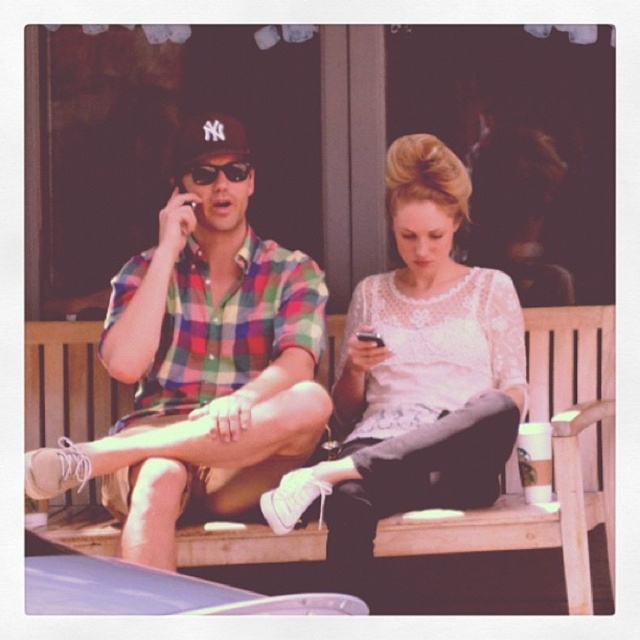
Question: Based on their relative distances, which object is nearer to the white lace blouse at center?

Choices:
 (A) plaid fabric shirt at center
 (B) black reflective sunglasses at center

Answer: (A)

Question: Where is plaid fabric shirt at center located in relation to white lace blouse at center in the image?

Choices:
 (A) right
 (B) left

Answer: (B)

Question: Which of these objects is positioned closest to the plaid fabric shirt at center?

Choices:
 (A) black reflective sunglasses at center
 (B) white lace blouse at center
 (C) wooden bench at center

Answer: (B)

Question: Can you confirm if wooden bench at center is smaller than black reflective sunglasses at center?

Choices:
 (A) no
 (B) yes

Answer: (A)

Question: Which object appears closest to the camera in this image?

Choices:
 (A) white lace blouse at center
 (B) plaid fabric shirt at center
 (C) black reflective sunglasses at center

Answer: (B)

Question: Can you confirm if white lace blouse at center is positioned below wooden bench at center?

Choices:
 (A) yes
 (B) no

Answer: (B)